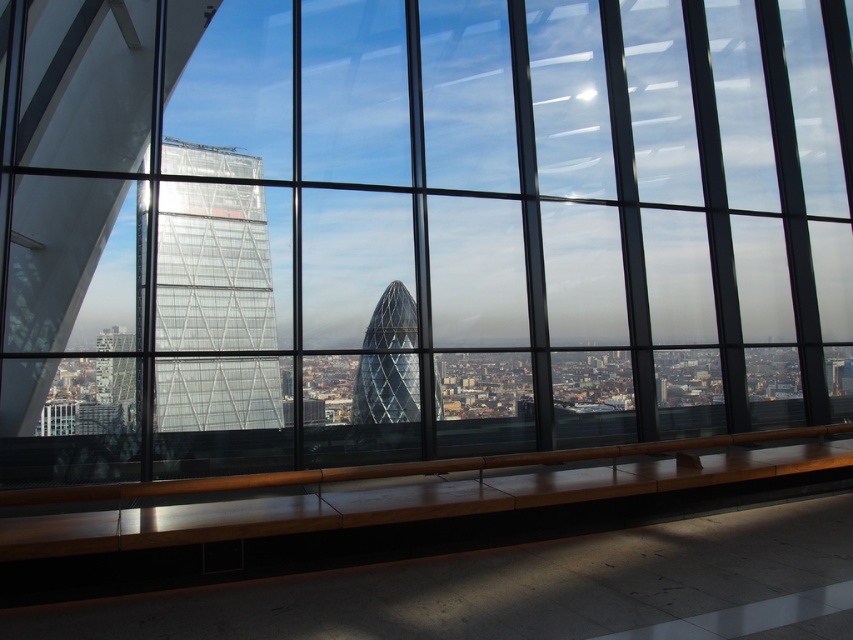
Question: From the image, what is the correct spatial relationship of transparent glass tower at left in relation to glassy steel tower at center?

Choices:
 (A) below
 (B) above

Answer: (B)

Question: Is transparent glass tower at left below glassy steel tower at center?

Choices:
 (A) no
 (B) yes

Answer: (A)

Question: Among these points, which one is nearest to the camera?

Choices:
 (A) (383, 337)
 (B) (242, 321)

Answer: (B)

Question: Which of the following is the closest to the observer?

Choices:
 (A) (440, 401)
 (B) (195, 280)

Answer: (B)

Question: Is transparent glass tower at left smaller than glassy steel tower at center?

Choices:
 (A) no
 (B) yes

Answer: (A)

Question: Which object appears closest to the camera in this image?

Choices:
 (A) transparent glass tower at left
 (B) glassy steel tower at center

Answer: (A)